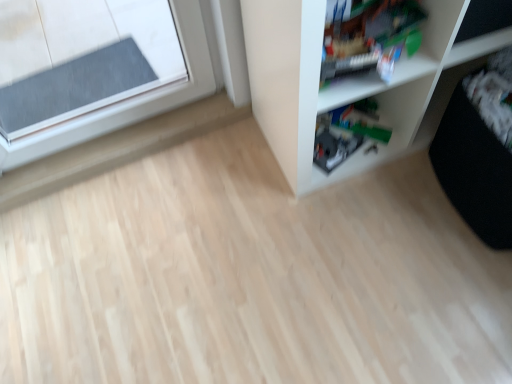
Question: Do you think white plastic shelf at upper right is within translucent plastic toy at upper right, or outside of it?

Choices:
 (A) outside
 (B) inside

Answer: (A)

Question: In the image, is white plastic shelf at upper right positioned in front of or behind translucent plastic toy at upper right?

Choices:
 (A) front
 (B) behind

Answer: (A)

Question: Looking at their shapes, would you say white plastic shelf at upper right is wider or thinner than translucent plastic toy at upper right?

Choices:
 (A) thin
 (B) wide

Answer: (B)

Question: Considering the relative positions of translucent plastic toy at upper right and white plastic shelf at upper right in the image provided, is translucent plastic toy at upper right to the left or to the right of white plastic shelf at upper right?

Choices:
 (A) right
 (B) left

Answer: (B)

Question: From the image's perspective, is translucent plastic toy at upper right positioned above or below white plastic shelf at upper right?

Choices:
 (A) above
 (B) below

Answer: (B)

Question: From a real-world perspective, relative to white plastic shelf at upper right, is translucent plastic toy at upper right vertically above or below?

Choices:
 (A) above
 (B) below

Answer: (A)

Question: Considering the positions of translucent plastic toy at upper right and white plastic shelf at upper right in the image, is translucent plastic toy at upper right bigger or smaller than white plastic shelf at upper right?

Choices:
 (A) big
 (B) small

Answer: (B)